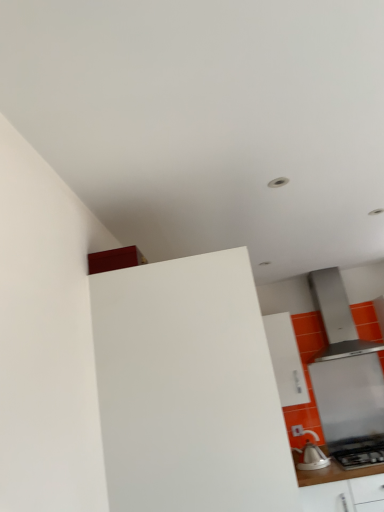
Question: Considering the relative sizes of white matte cabinet at center, which is the 2th cabinetry in right-to-left order, and white glossy kettle at lower right in the image provided, is white matte cabinet at center, which is the 2th cabinetry in right-to-left order, smaller than white glossy kettle at lower right?

Choices:
 (A) yes
 (B) no

Answer: (B)

Question: Can you confirm if white matte cabinet at center, which is the 1th cabinetry in left-to-right order, is thinner than white glossy kettle at lower right?

Choices:
 (A) yes
 (B) no

Answer: (B)

Question: Can you confirm if white matte cabinet at center, the 2th cabinetry from the back, is wider than white glossy kettle at lower right?

Choices:
 (A) no
 (B) yes

Answer: (B)

Question: Does white matte cabinet at center, the 2th cabinetry from the back, have a lesser height compared to white glossy kettle at lower right?

Choices:
 (A) yes
 (B) no

Answer: (B)

Question: Is white matte cabinet at center, the 1th cabinetry when ordered from front to back, outside of white glossy kettle at lower right?

Choices:
 (A) no
 (B) yes

Answer: (B)

Question: Looking at the image, does white glossy kettle at lower right seem bigger or smaller compared to white matte cabinet at center, the 2th cabinetry from the back?

Choices:
 (A) big
 (B) small

Answer: (B)

Question: Is point (304, 464) closer or farther from the camera than point (150, 360)?

Choices:
 (A) closer
 (B) farther

Answer: (B)

Question: From the image's perspective, is white glossy kettle at lower right located above or below white matte cabinet at center, which is the 1th cabinetry in left-to-right order?

Choices:
 (A) above
 (B) below

Answer: (B)

Question: Visually, is white glossy kettle at lower right positioned to the left or to the right of white matte cabinet at center, which is the 1th cabinetry in left-to-right order?

Choices:
 (A) right
 (B) left

Answer: (A)

Question: Which is correct: white matte cabinet at center, the 2th cabinetry from the back, is inside white glossy kettle at lower right, or outside of it?

Choices:
 (A) inside
 (B) outside

Answer: (B)

Question: Based on their positions, is white matte cabinet at center, the 2th cabinetry from the back, located to the left or right of white glossy kettle at lower right?

Choices:
 (A) left
 (B) right

Answer: (A)

Question: In terms of size, does white matte cabinet at center, which is the 2th cabinetry in right-to-left order, appear bigger or smaller than white glossy kettle at lower right?

Choices:
 (A) small
 (B) big

Answer: (B)

Question: From their relative heights in the image, would you say white matte cabinet at center, which is the 2th cabinetry in right-to-left order, is taller or shorter than white glossy kettle at lower right?

Choices:
 (A) short
 (B) tall

Answer: (B)

Question: In terms of size, does satin silver range hood at right appear bigger or smaller than white matte cabinet at center, the 1th cabinetry when ordered from front to back?

Choices:
 (A) big
 (B) small

Answer: (B)

Question: Considering the positions of point (359, 414) and point (100, 394), is point (359, 414) closer or farther from the camera than point (100, 394)?

Choices:
 (A) closer
 (B) farther

Answer: (B)